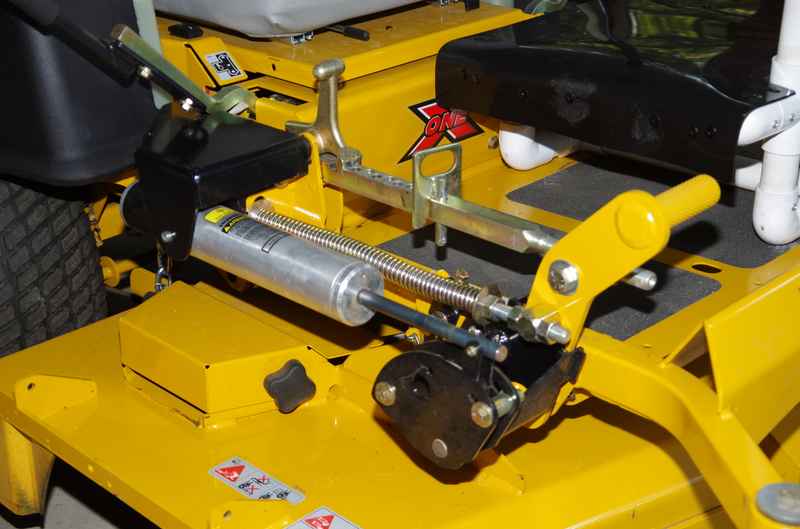
You are a GUI agent. You are given a task and a screenshot of the screen. Output one action in this format:
    pyautogui.click(x=<x>, y=<y>)
    Task: Click on the knob
    This screenshot has height=529, width=800.
    Given the screenshot: What is the action you would take?
    click(x=294, y=395)